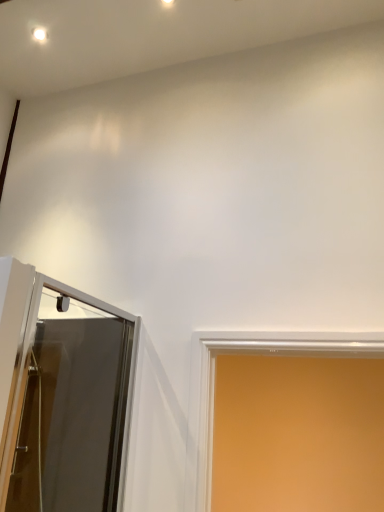
In order to face clear glass screen door at left, should I rotate leftwards or rightwards?

Turn left approximately 15.006 degrees to face it.

The width and height of the screenshot is (384, 512). Find the location of `clear glass screen door at left`. clear glass screen door at left is located at coordinates (62, 395).

What do you see at coordinates (62, 395) in the screenshot?
I see `clear glass screen door at left` at bounding box center [62, 395].

Identify the location of clear glass screen door at left. (62, 395).